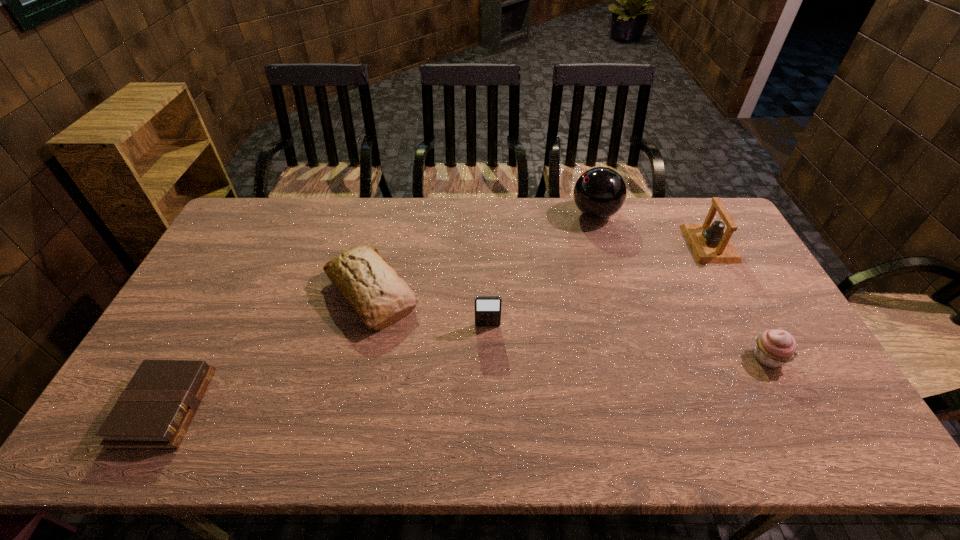
Where is `bell that is at the right edge`? The image size is (960, 540). bell that is at the right edge is located at coordinates (710, 243).

At what (x,y) coordinates should I click in order to perform the action: click on cupcake situated at the right edge. Please return your answer as a coordinate pair (x, y). This screenshot has width=960, height=540. Looking at the image, I should click on (774, 348).

You are a GUI agent. You are given a task and a screenshot of the screen. Output one action in this format:
    pyautogui.click(x=<x>, y=<y>)
    Task: Click on the object that is at the near left corner
    This screenshot has height=540, width=960.
    Given the screenshot: What is the action you would take?
    pyautogui.click(x=153, y=412)

The height and width of the screenshot is (540, 960). Find the location of `object present at the far right corner`. object present at the far right corner is located at coordinates (710, 243).

Where is `free region at the far edge`? The image size is (960, 540). free region at the far edge is located at coordinates [x=500, y=227].

This screenshot has width=960, height=540. In the image, there is a desktop. What are the coordinates of `blank space at the near edge` in the screenshot? It's located at (562, 429).

Locate an element on the screen. Image resolution: width=960 pixels, height=540 pixels. vacant space at the right edge of the desktop is located at coordinates (775, 309).

At what (x,y) coordinates should I click in order to perform the action: click on vacant region at the far left corner of the desktop. Please return your answer as a coordinate pair (x, y). This screenshot has width=960, height=540. Looking at the image, I should click on (266, 205).

Where is `unoccupied position between the iPod and the bread`? This screenshot has width=960, height=540. unoccupied position between the iPod and the bread is located at coordinates (430, 309).

Find the location of a particular element. Image resolution: width=960 pixels, height=540 pixels. free space between the third object from right to left and the bread is located at coordinates 483,254.